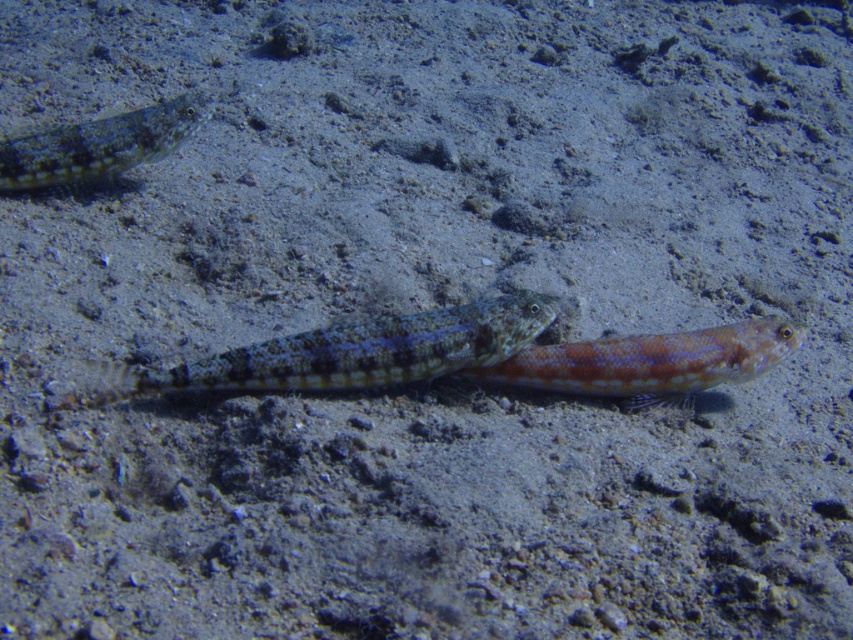
Is point (90, 387) positioned before point (102, 161)?

Yes, it is in front of point (102, 161).

Who is lower down, speckled sand eel at center or speckled skin fish at upper left?

speckled sand eel at center

You are a GUI agent. You are given a task and a screenshot of the screen. Output one action in this format:
    pyautogui.click(x=<x>, y=<y>)
    Task: Click on the speckled sand eel at center
    
    Given the screenshot: What is the action you would take?
    pyautogui.click(x=347, y=353)

The width and height of the screenshot is (853, 640). In order to click on speckled sand eel at center in this screenshot , I will do `click(347, 353)`.

Who is positioned more to the left, shiny orange fish at center or speckled skin fish at upper left?

Positioned to the left is speckled skin fish at upper left.

Between shiny orange fish at center and speckled skin fish at upper left, which one is positioned lower?

shiny orange fish at center is below.

Which is in front, point (582, 371) or point (45, 163)?

Point (582, 371)

You are a GUI agent. You are given a task and a screenshot of the screen. Output one action in this format:
    pyautogui.click(x=<x>, y=<y>)
    Task: Click on the shiny orange fish at center
    
    Given the screenshot: What is the action you would take?
    [x=650, y=362]

Between speckled sand eel at center and shiny orange fish at center, which one has less height?

shiny orange fish at center

From the picture: Is speckled sand eel at center positioned behind shiny orange fish at center?

No, it is in front of shiny orange fish at center.

Is point (120, 372) positioned behind point (566, 378)?

That is False.

Locate an element on the screen. This screenshot has height=640, width=853. speckled sand eel at center is located at coordinates click(347, 353).